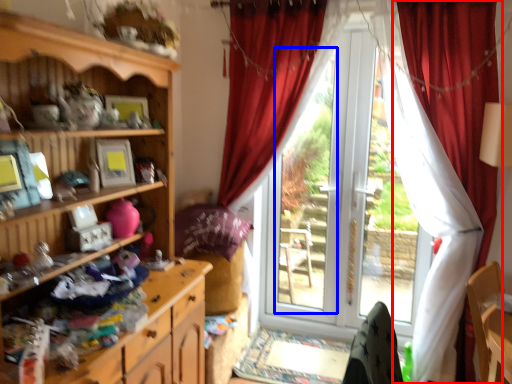
Question: Which point is further to the camera, curtain (highlighted by a red box) or bay window (highlighted by a blue box)?

Choices:
 (A) curtain
 (B) bay window

Answer: (B)